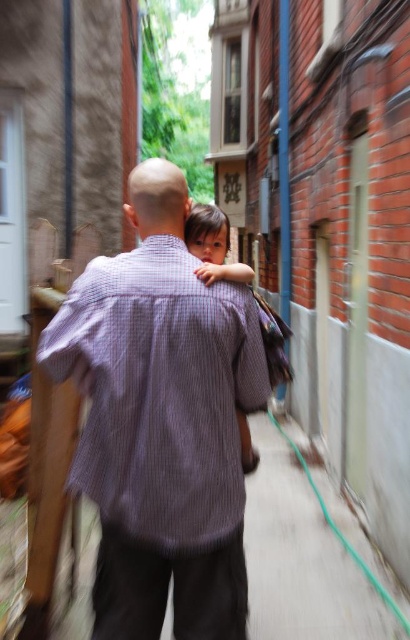
Question: Does purple corduroy shirt at center have a smaller size compared to smooth skin child at center?

Choices:
 (A) no
 (B) yes

Answer: (A)

Question: Is purple corduroy shirt at center below smooth skin child at center?

Choices:
 (A) yes
 (B) no

Answer: (A)

Question: Among these objects, which one is farthest from the camera?

Choices:
 (A) smooth skin child at center
 (B) purple corduroy shirt at center

Answer: (A)

Question: Is purple corduroy shirt at center positioned before smooth skin child at center?

Choices:
 (A) yes
 (B) no

Answer: (A)